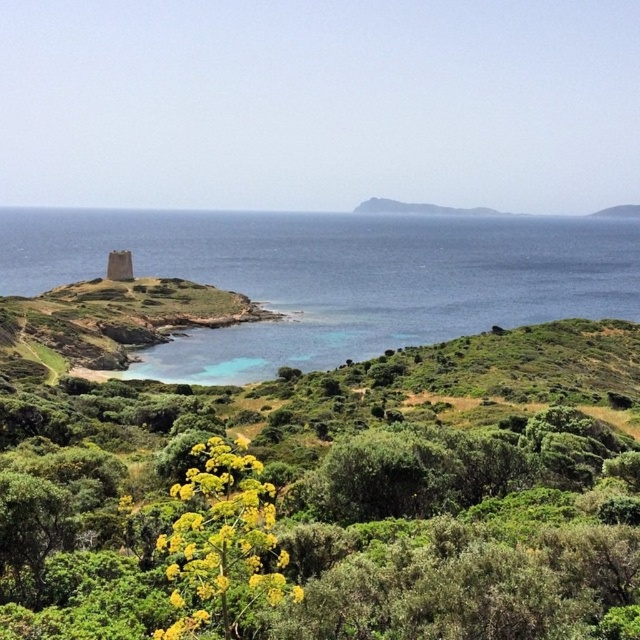
You are a drone operator trying to capture the best aerial shot of the blue water at left. The drone has a GPS coordinate system where the bottom left corner is the origin point. The blue water at left is located at point (333, 276). The drone is currently at point 0.3, 0.3. Which direction should you move the drone to reach the blue water at left?

The blue water at left is located at point (333, 276). The drone is currently at point 0.3, 0.3. To reach the blue water at left, you should move the drone northeast because the target point has higher x and y coordinates than the current position.

You are standing on the peninsula and want to walk to the yellow flower at center. Which direction should you walk to avoid the blue water at left?

You should walk to the right because the blue water at left is to the left of the yellow flower at center, so moving right will keep you away from the water.